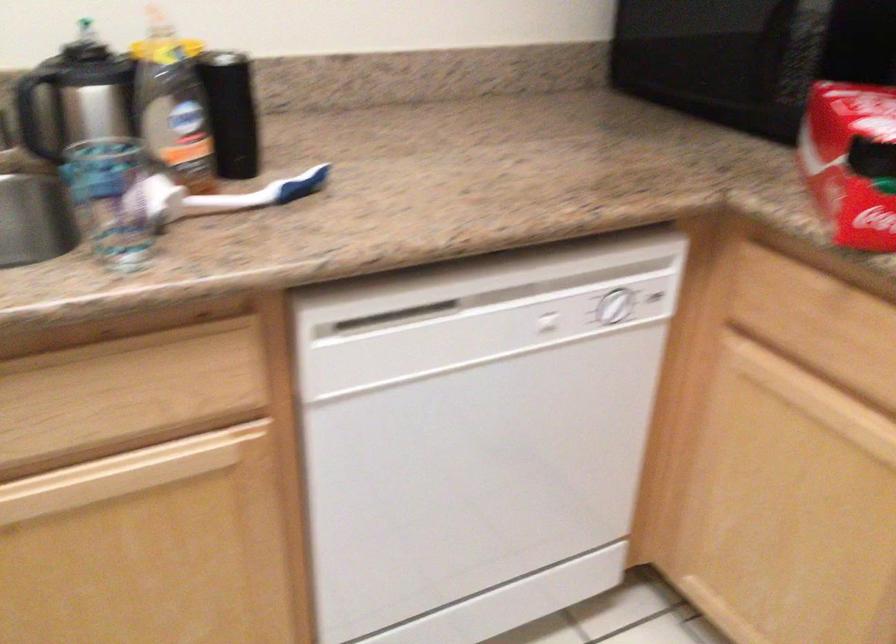
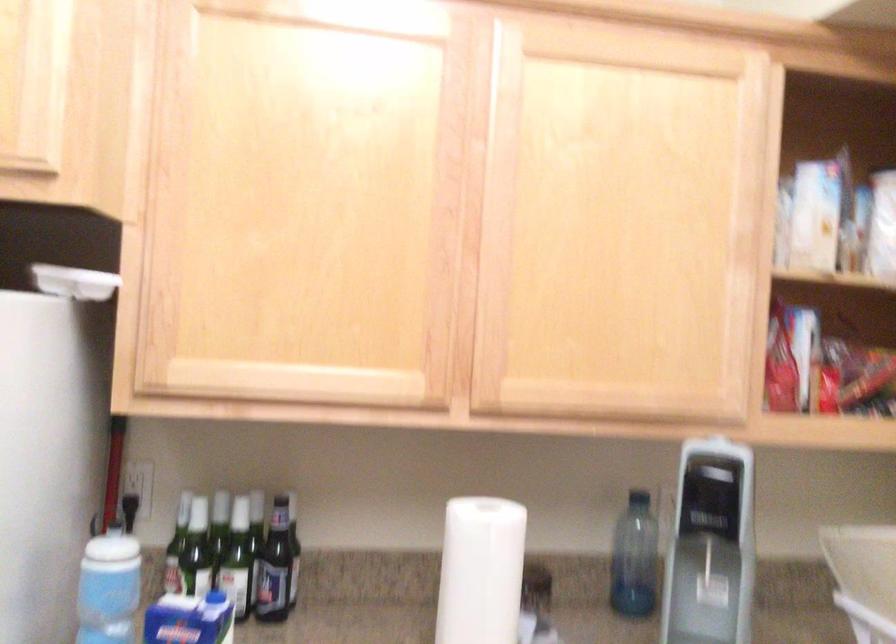
Question: The images are taken continuously from a first-person perspective. In which direction is your viewpoint rotating?

Choices:
 (A) Left
 (B) Right
 (C) Up
 (D) Down

Answer: (A)